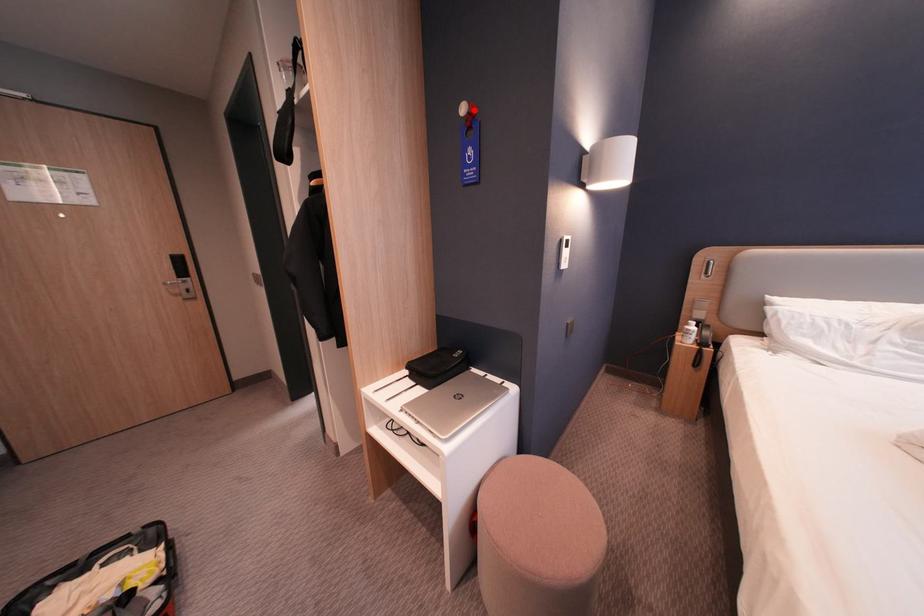
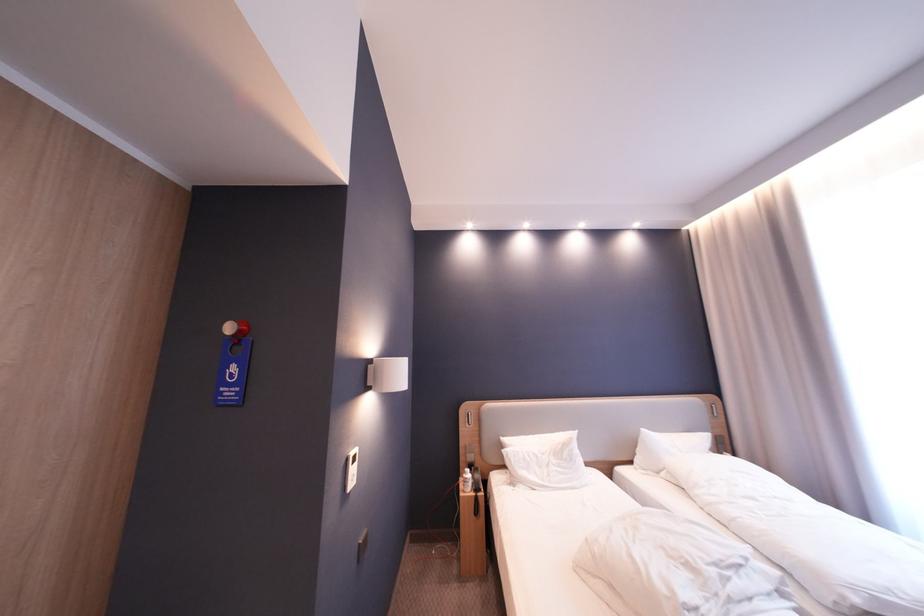
Question: I am providing you with two images of the same scene from different viewpoints. A red point is marked on the first image. At the location where the point appears in image 1, is it still visible in image 2?

Choices:
 (A) Yes
 (B) No

Answer: (A)